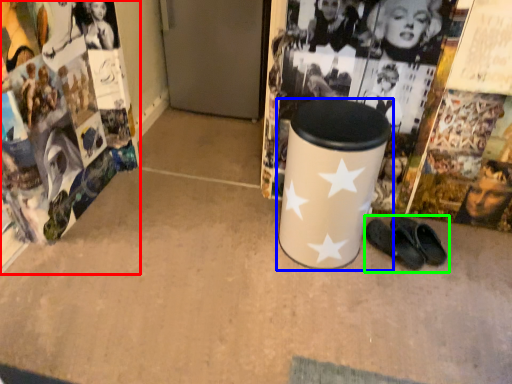
Question: Based on their relative distances, which object is nearer to magazine (highlighted by a red box)? Choose from waste container (highlighted by a blue box) and footwear (highlighted by a green box).

Choices:
 (A) waste container
 (B) footwear

Answer: (A)